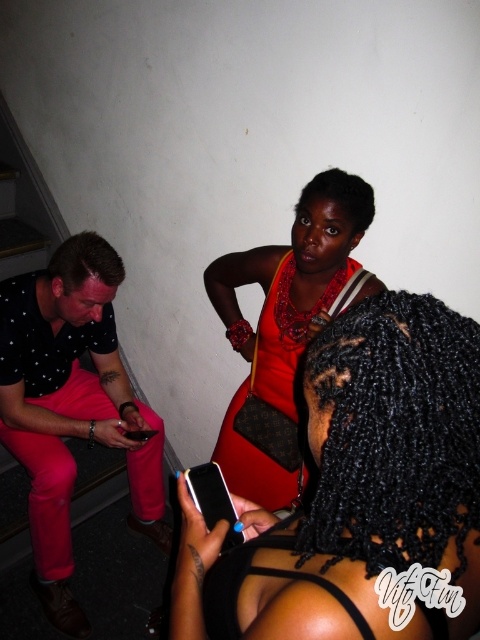
Is shiny red dress at center taller than polka dot fabric shirt at left?

No, shiny red dress at center is not taller than polka dot fabric shirt at left.

Find the location of a particular element. The height and width of the screenshot is (640, 480). shiny red dress at center is located at coordinates (357, 490).

Find the location of a particular element. shiny red dress at center is located at coordinates (357, 490).

Locate an element on the screen. The image size is (480, 640). shiny red dress at center is located at coordinates (357, 490).

Which is below, shiny red dress at center or shiny orange fabric dress at center?

shiny red dress at center is lower down.

Who is more distant from viewer, (274,538) or (253,472)?

The point (253,472) is more distant.

Where is `shiny red dress at center`? shiny red dress at center is located at coordinates (357, 490).

Does polka dot fabric shirt at left appear on the right side of shiny orange fabric dress at center?

No, polka dot fabric shirt at left is not to the right of shiny orange fabric dress at center.

Can you confirm if polka dot fabric shirt at left is smaller than shiny orange fabric dress at center?

No.

Find the location of `polka dot fabric shirt at left`. polka dot fabric shirt at left is located at coordinates (72, 406).